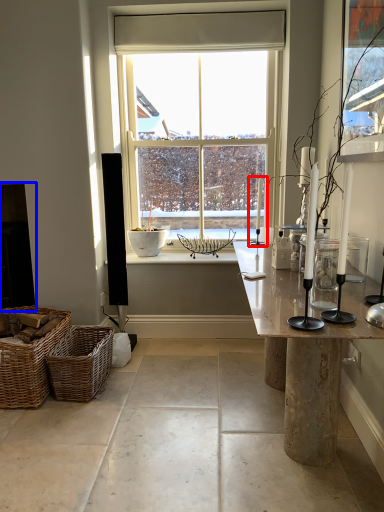
Question: Which of the following is the farthest to the observer, candle holder (highlighted by a red box) or fireplace (highlighted by a blue box)?

Choices:
 (A) candle holder
 (B) fireplace

Answer: (B)